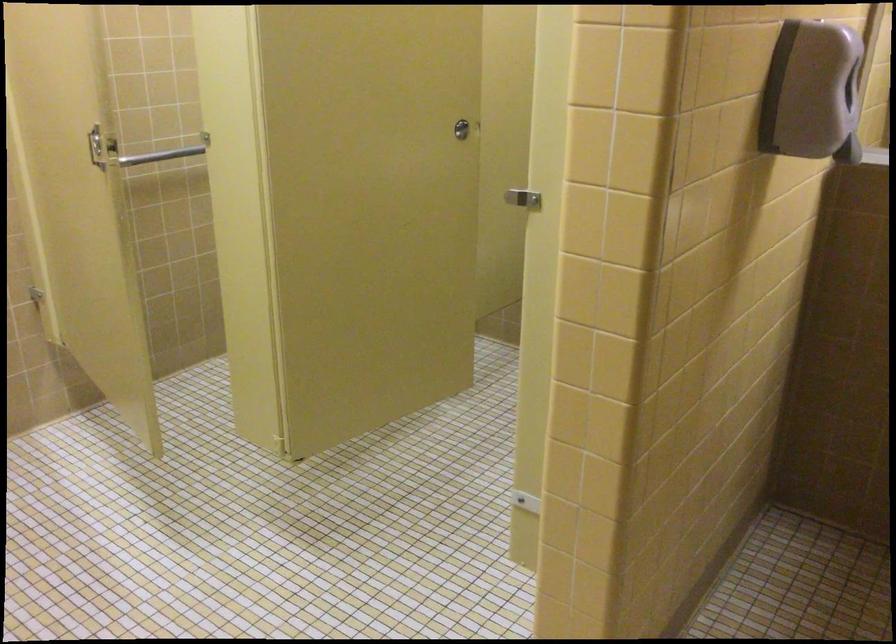
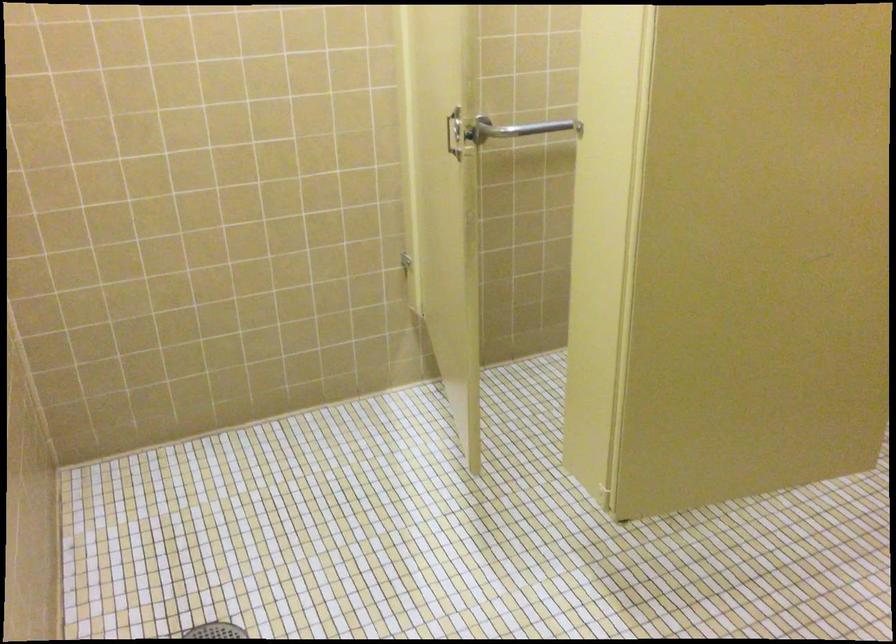
Question: In a continuous first-person perspective shot, in which direction is the camera moving?

Choices:
 (A) Left
 (B) Right
 (C) Forward
 (D) Backward

Answer: (C)